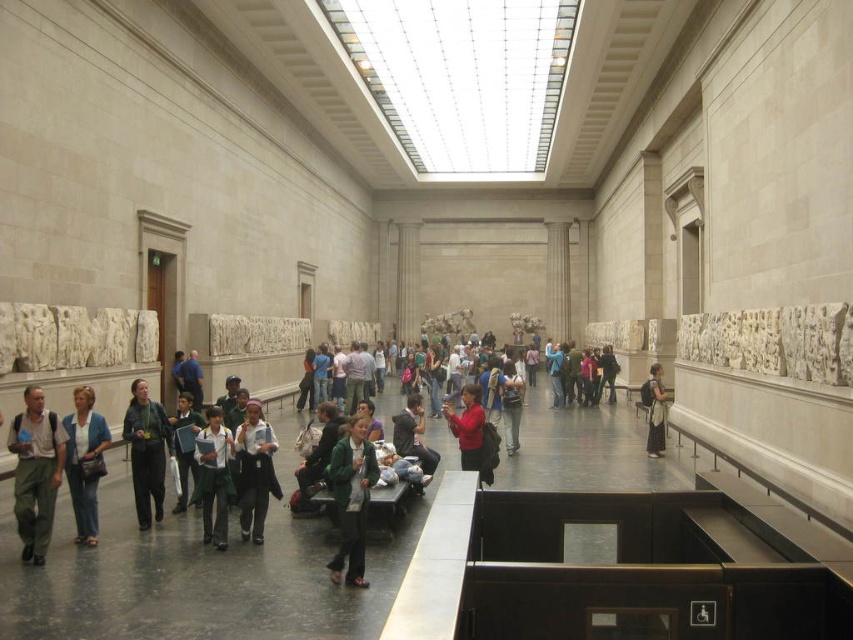
Which is behind, point (202, 492) or point (653, 448)?

The point (653, 448) is more distant.

Is point (216, 529) less distant than point (650, 378)?

Yes.

In order to click on green uniform at center in this screenshot , I will do `click(213, 476)`.

Does point (51, 460) come closer to viewer compared to point (654, 420)?

Yes, point (51, 460) is in front of point (654, 420).

Does light brown fabric jacket at lower left have a smaller size compared to matte black backpack at center?

Correct, light brown fabric jacket at lower left occupies less space than matte black backpack at center.

Based on the photo, who is more forward, (x=22, y=464) or (x=650, y=428)?

Positioned in front is point (x=22, y=464).

Where is `light brown fabric jacket at lower left`? light brown fabric jacket at lower left is located at coordinates (35, 472).

Consider the image. Is green matte jacket at center wider than denim jacket at center?

Correct, the width of green matte jacket at center exceeds that of denim jacket at center.

Which is more to the left, green matte jacket at center or denim jacket at center?

denim jacket at center

Locate an element on the screen. Image resolution: width=853 pixels, height=640 pixels. green matte jacket at center is located at coordinates (351, 499).

The height and width of the screenshot is (640, 853). In order to click on green matte jacket at center in this screenshot , I will do `click(351, 499)`.